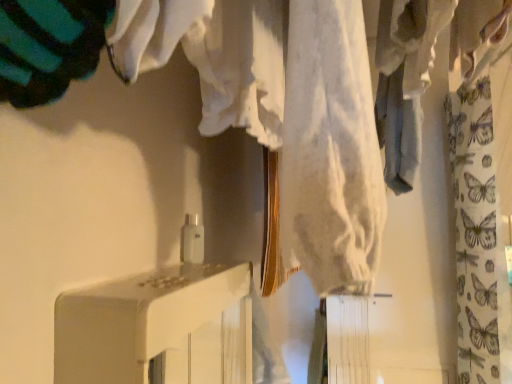
Locate an element on the screen. Image resolution: width=512 pixels, height=384 pixels. butterfly-patterned fabric at right is located at coordinates (478, 240).

The height and width of the screenshot is (384, 512). What do you see at coordinates (478, 240) in the screenshot?
I see `butterfly-patterned fabric at right` at bounding box center [478, 240].

The image size is (512, 384). What do you see at coordinates (157, 328) in the screenshot?
I see `white glossy cabinet at center` at bounding box center [157, 328].

Identify the location of white glossy cabinet at center. Image resolution: width=512 pixels, height=384 pixels. (157, 328).

Locate an element on the screen. butterfly-patterned fabric at right is located at coordinates (478, 240).

Considering the relative positions of white glossy cabinet at center and butterfly-patterned fabric at right in the image provided, is white glossy cabinet at center to the left of butterfly-patterned fabric at right from the viewer's perspective?

Yes.

Considering the relative positions of white glossy cabinet at center and butterfly-patterned fabric at right in the image provided, is white glossy cabinet at center behind butterfly-patterned fabric at right?

No.

Does point (245, 302) appear closer or farther from the camera than point (460, 378)?

Clearly, point (245, 302) is closer to the camera than point (460, 378).

From the image's perspective, which is below, white glossy cabinet at center or butterfly-patterned fabric at right?

white glossy cabinet at center, from the image's perspective.

From a real-world perspective, is white glossy cabinet at center physically located above or below butterfly-patterned fabric at right?

white glossy cabinet at center is situated lower than butterfly-patterned fabric at right in the real world.

Can you confirm if white glossy cabinet at center is wider than butterfly-patterned fabric at right?

No, white glossy cabinet at center is not wider than butterfly-patterned fabric at right.

Is white glossy cabinet at center taller than butterfly-patterned fabric at right?

Incorrect, the height of white glossy cabinet at center is not larger of that of butterfly-patterned fabric at right.

Who is smaller, white glossy cabinet at center or butterfly-patterned fabric at right?

Smaller between the two is white glossy cabinet at center.

Is white glossy cabinet at center inside the boundaries of butterfly-patterned fabric at right, or outside?

white glossy cabinet at center is not inside butterfly-patterned fabric at right, it's outside.

Is white glossy cabinet at center touching butterfly-patterned fabric at right?

No, white glossy cabinet at center is not making contact with butterfly-patterned fabric at right.

Is white glossy cabinet at center aimed at butterfly-patterned fabric at right?

No, white glossy cabinet at center is not aimed at butterfly-patterned fabric at right.

From the picture: Can you tell me how much white glossy cabinet at center and butterfly-patterned fabric at right differ in facing direction?

The facing directions of white glossy cabinet at center and butterfly-patterned fabric at right are 90.1 degrees apart.

You are a GUI agent. You are given a task and a screenshot of the screen. Output one action in this format:
    pyautogui.click(x=<x>, y=<y>)
    Task: Click on the curtain that is behind the white glossy cabinet at center
    The height and width of the screenshot is (384, 512).
    Given the screenshot: What is the action you would take?
    pyautogui.click(x=478, y=240)

Which object is positioned more to the right, butterfly-patterned fabric at right or white glossy cabinet at center?

butterfly-patterned fabric at right.

Does butterfly-patterned fabric at right lie in front of white glossy cabinet at center?

No, butterfly-patterned fabric at right is behind white glossy cabinet at center.

Is point (448, 107) closer or farther from the camera than point (231, 364)?

Point (448, 107).

From the image's perspective, relative to white glossy cabinet at center, is butterfly-patterned fabric at right above or below?

Clearly, from the image's perspective, butterfly-patterned fabric at right is above white glossy cabinet at center.

From a real-world perspective, is butterfly-patterned fabric at right positioned under white glossy cabinet at center based on gravity?

No, from a real-world perspective, butterfly-patterned fabric at right is not under white glossy cabinet at center.

Which of these two, butterfly-patterned fabric at right or white glossy cabinet at center, is wider?

With larger width is butterfly-patterned fabric at right.

Can you confirm if butterfly-patterned fabric at right is taller than white glossy cabinet at center?

Yes, butterfly-patterned fabric at right is taller than white glossy cabinet at center.

In the scene shown: Is butterfly-patterned fabric at right bigger than white glossy cabinet at center?

Yes.

Is butterfly-patterned fabric at right not inside white glossy cabinet at center?

Indeed, butterfly-patterned fabric at right is completely outside white glossy cabinet at center.

Is butterfly-patterned fabric at right far away from white glossy cabinet at center?

No.

Is butterfly-patterned fabric at right oriented towards white glossy cabinet at center?

No, butterfly-patterned fabric at right is not aimed at white glossy cabinet at center.

How different are the orientations of butterfly-patterned fabric at right and white glossy cabinet at center in degrees?

They differ by 90.1 degrees in their facing directions.

At what (x,y) coordinates should I click in order to perform the action: click on furniture on the left of butterfly-patterned fabric at right. Please return your answer as a coordinate pair (x, y). The width and height of the screenshot is (512, 384). Looking at the image, I should click on (157, 328).

Locate an element on the screen. This screenshot has width=512, height=384. furniture in front of the butterfly-patterned fabric at right is located at coordinates click(x=157, y=328).

Locate an element on the screen. furniture on the left of butterfly-patterned fabric at right is located at coordinates (157, 328).